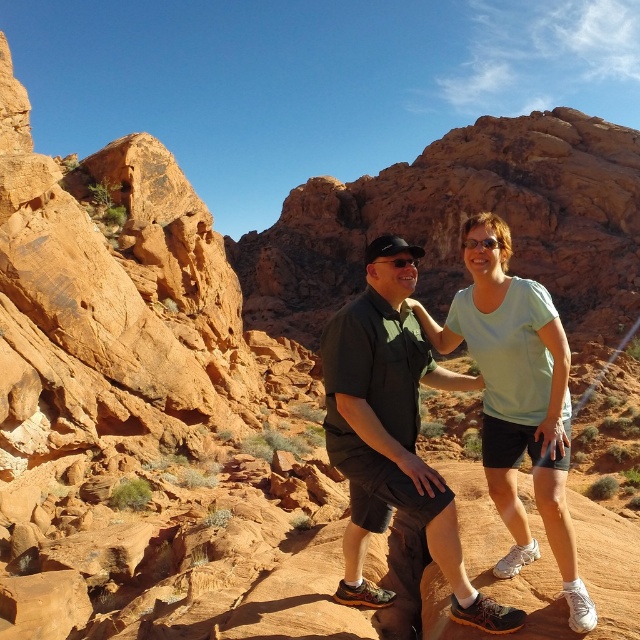
Question: Estimate the real-world distances between objects in this image. Which object is closer to the light blue t-shirt at center?

Choices:
 (A) black matte sunglasses at center
 (B) matte green shirt at center

Answer: (B)

Question: Does matte green shirt at center have a greater width compared to light blue t-shirt at center?

Choices:
 (A) no
 (B) yes

Answer: (A)

Question: Is light blue t-shirt at center closer to camera compared to black matte sunglasses at center?

Choices:
 (A) no
 (B) yes

Answer: (B)

Question: In this image, where is matte green shirt at center located relative to light blue t-shirt at center?

Choices:
 (A) below
 (B) above

Answer: (B)

Question: Among these objects, which one is farthest from the camera?

Choices:
 (A) light blue t-shirt at center
 (B) black matte sunglasses at center
 (C) matte green shirt at center

Answer: (B)

Question: Among these points, which one is farthest from the camera?

Choices:
 (A) (333, 432)
 (B) (412, 260)

Answer: (B)